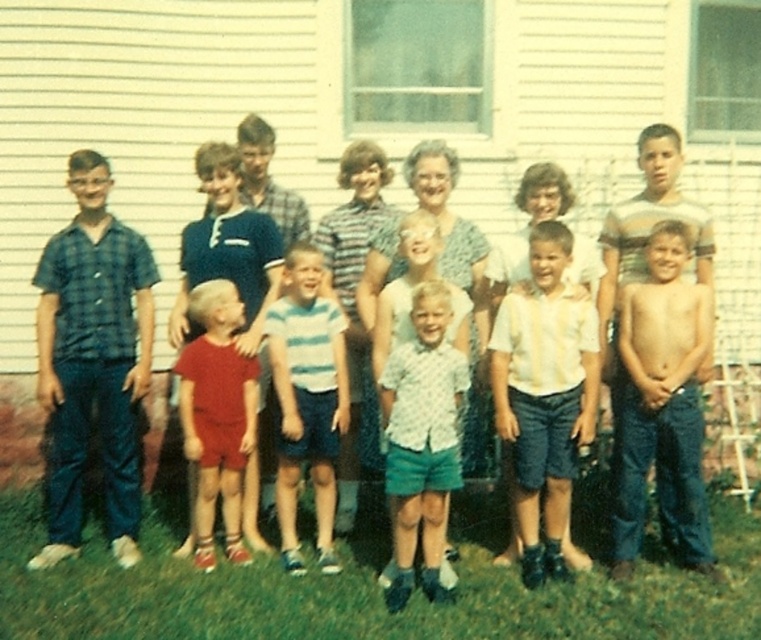
Between plaid fabric shirt at left and light blue denim shorts at center, which one is positioned higher?

plaid fabric shirt at left is above.

The image size is (761, 640). In order to click on plaid fabric shirt at left in this screenshot , I will do `click(94, 360)`.

Who is more distant from viewer, (123, 262) or (392, 380)?

Positioned behind is point (123, 262).

Identify the location of plaid fabric shirt at left. (94, 360).

Is plaid fabric shirt at left wider than white cotton shirt at center?

Yes, plaid fabric shirt at left is wider than white cotton shirt at center.

Image resolution: width=761 pixels, height=640 pixels. Describe the element at coordinates (94, 360) in the screenshot. I see `plaid fabric shirt at left` at that location.

Does point (100, 282) come in front of point (514, 484)?

That is False.

Where is `plaid fabric shirt at left`? This screenshot has height=640, width=761. plaid fabric shirt at left is located at coordinates (94, 360).

Based on the photo, between light blue denim shorts at center and striped cotton shirt at center, which one has less height?

light blue denim shorts at center

Does light blue denim shorts at center have a greater height compared to striped cotton shirt at center?

Incorrect, light blue denim shorts at center's height is not larger of striped cotton shirt at center's.

Who is more forward, (x=416, y=365) or (x=291, y=410)?

Point (x=416, y=365) is in front.

Identify the location of light blue denim shorts at center. (422, 440).